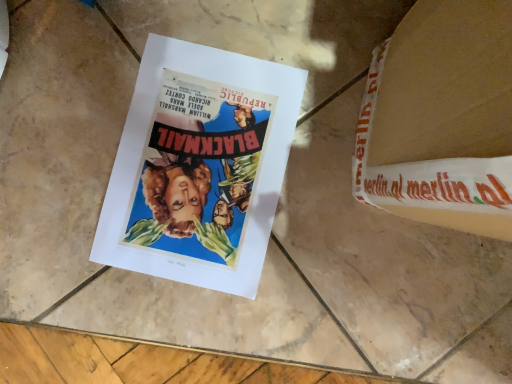
Question: From their relative heights in the image, would you say matte paper poster at center is taller or shorter than white cardboard at upper right?

Choices:
 (A) short
 (B) tall

Answer: (A)

Question: Looking at the image, does matte paper poster at center seem bigger or smaller compared to white cardboard at upper right?

Choices:
 (A) big
 (B) small

Answer: (B)

Question: Would you say matte paper poster at center is to the left or to the right of white cardboard at upper right in the picture?

Choices:
 (A) left
 (B) right

Answer: (A)

Question: Considering the positions of white cardboard at upper right and matte paper poster at center in the image, is white cardboard at upper right taller or shorter than matte paper poster at center?

Choices:
 (A) tall
 (B) short

Answer: (A)

Question: Is point (486, 122) closer or farther from the camera than point (193, 87)?

Choices:
 (A) closer
 (B) farther

Answer: (A)

Question: Considering the positions of white cardboard at upper right and matte paper poster at center in the image, is white cardboard at upper right bigger or smaller than matte paper poster at center?

Choices:
 (A) big
 (B) small

Answer: (A)

Question: In terms of width, does white cardboard at upper right look wider or thinner when compared to matte paper poster at center?

Choices:
 (A) wide
 (B) thin

Answer: (A)